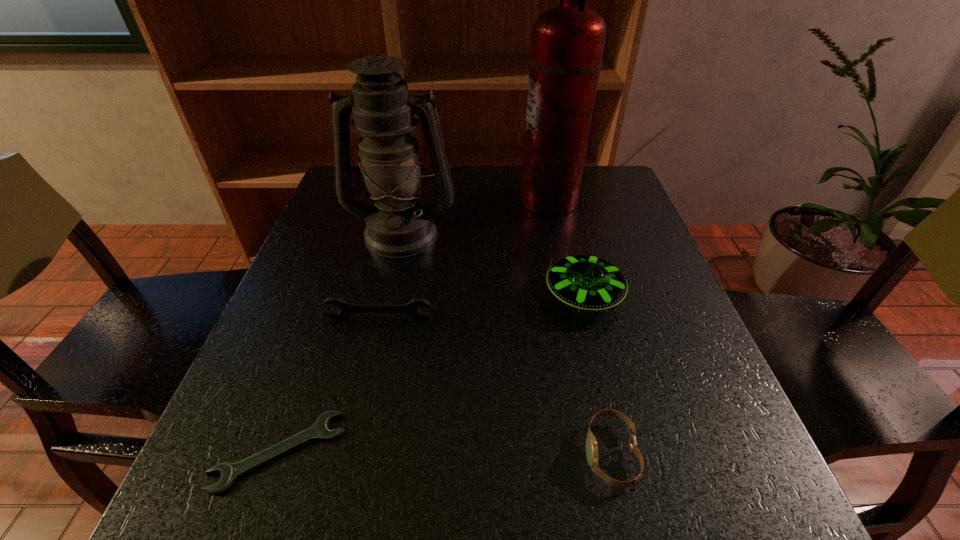
This screenshot has height=540, width=960. Identify the location of the tallest object. [x=567, y=44].

The width and height of the screenshot is (960, 540). I want to click on oil lamp, so click(399, 225).

You are a GUI agent. You are given a task and a screenshot of the screen. Output one action in this format:
    pyautogui.click(x=<x>, y=<y>)
    Task: Click on the saucer
    The width and height of the screenshot is (960, 540).
    Given the screenshot: What is the action you would take?
    pyautogui.click(x=585, y=282)

This screenshot has width=960, height=540. In order to click on the farther wrench in this screenshot , I will do `click(411, 308)`.

This screenshot has width=960, height=540. I want to click on watch, so click(x=591, y=445).

Locate an element on the screen. The width and height of the screenshot is (960, 540). the shorter wrench is located at coordinates (229, 472).

Where is `the shortest object`? This screenshot has width=960, height=540. the shortest object is located at coordinates (229, 472).

This screenshot has height=540, width=960. Find the location of `vacant point located on the side of the fire extinguisher with the handle and hose`. vacant point located on the side of the fire extinguisher with the handle and hose is located at coordinates (459, 200).

What are the coordinates of `blank space located on the side of the fire extinguisher with the handle and hose` in the screenshot? It's located at (500, 200).

At what (x,y) coordinates should I click in order to perform the action: click on vacant point located 0.220m on the side of the fire extinguisher with the handle and hose. Please return your answer as a coordinate pair (x, y). This screenshot has height=540, width=960. Looking at the image, I should click on (437, 200).